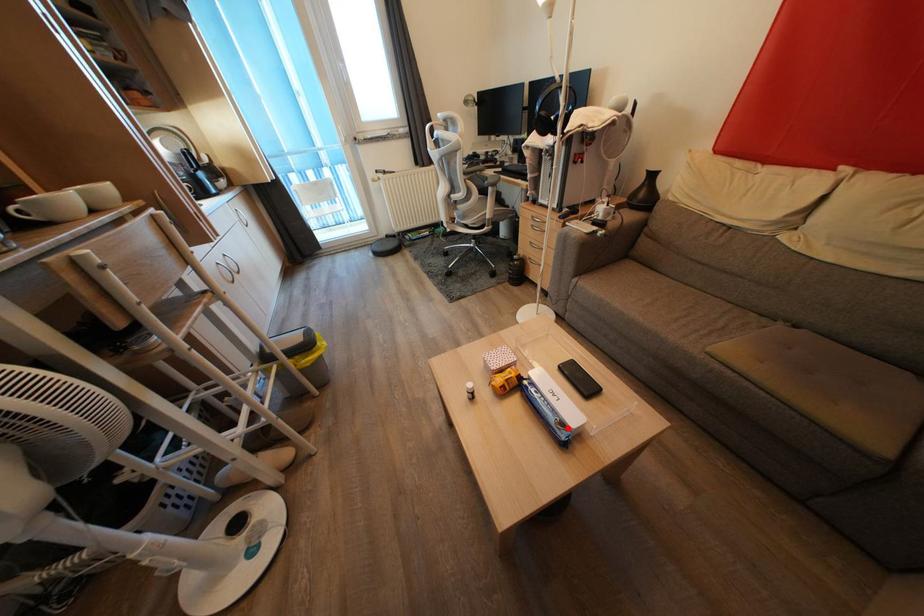
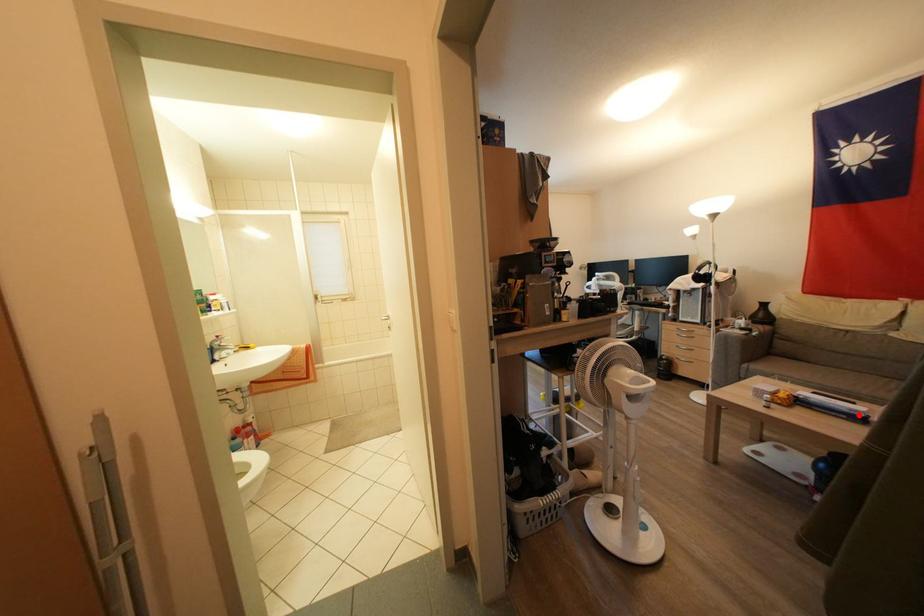
I am providing you with two images of the same scene from different viewpoints. A red point is marked on the first image and another point is marked on the second image. Is the red point in image1 aligned with the point shown in image2?

Yes